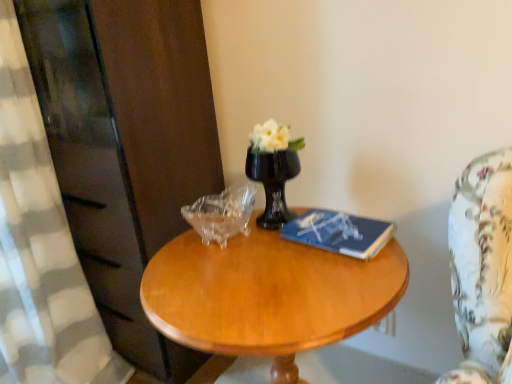
Question: Relative to light brown wood coffee table at center, is blue matte book at center in front or behind?

Choices:
 (A) behind
 (B) front

Answer: (A)

Question: Considering the positions of blue matte book at center and light brown wood coffee table at center in the image, is blue matte book at center taller or shorter than light brown wood coffee table at center?

Choices:
 (A) short
 (B) tall

Answer: (A)

Question: Based on their relative distances, which object is nearer to the transparent glass piggy bank at center?

Choices:
 (A) black glass vase at center
 (B) blue matte book at center
 (C) light brown wood coffee table at center
 (D) white textured curtain at left

Answer: (A)

Question: Estimate the real-world distances between objects in this image. Which object is closer to the blue matte book at center?

Choices:
 (A) light brown wood coffee table at center
 (B) white textured curtain at left
 (C) transparent glass piggy bank at center
 (D) black glass vase at center

Answer: (D)